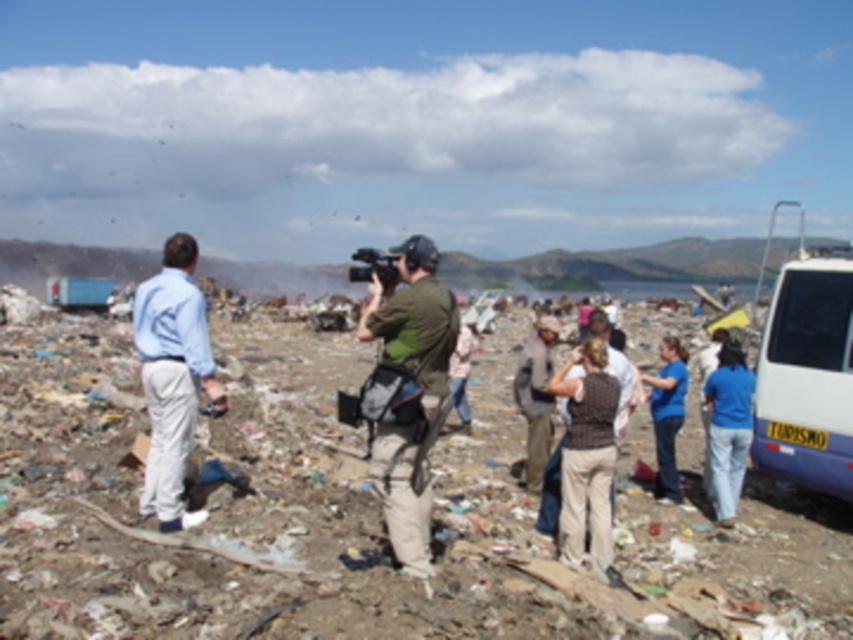
Is white plastic van at right thinner than green fabric camera at center?

In fact, white plastic van at right might be wider than green fabric camera at center.

Between white plastic van at right and green fabric camera at center, which one is positioned higher?

white plastic van at right

The height and width of the screenshot is (640, 853). What do you see at coordinates (807, 378) in the screenshot?
I see `white plastic van at right` at bounding box center [807, 378].

At what (x,y) coordinates should I click in order to perform the action: click on white plastic van at right. Please return your answer as a coordinate pair (x, y). This screenshot has height=640, width=853. Looking at the image, I should click on (807, 378).

Does white plastic van at right appear on the left side of blue cotton shirt at center?

Correct, you'll find white plastic van at right to the left of blue cotton shirt at center.

Is point (846, 452) farther from viewer compared to point (669, 497)?

No, (846, 452) is in front of (669, 497).

The height and width of the screenshot is (640, 853). In order to click on white plastic van at right in this screenshot , I will do `click(807, 378)`.

In the scene shown: Is brown knitted vest at center to the left of blue cotton shirt at center from the viewer's perspective?

Correct, you'll find brown knitted vest at center to the left of blue cotton shirt at center.

Which is more to the right, brown knitted vest at center or blue cotton shirt at center?

From the viewer's perspective, blue cotton shirt at center appears more on the right side.

Who is more distant from viewer, (585, 413) or (664, 465)?

Point (664, 465)

Locate an element on the screen. This screenshot has width=853, height=640. brown knitted vest at center is located at coordinates (585, 456).